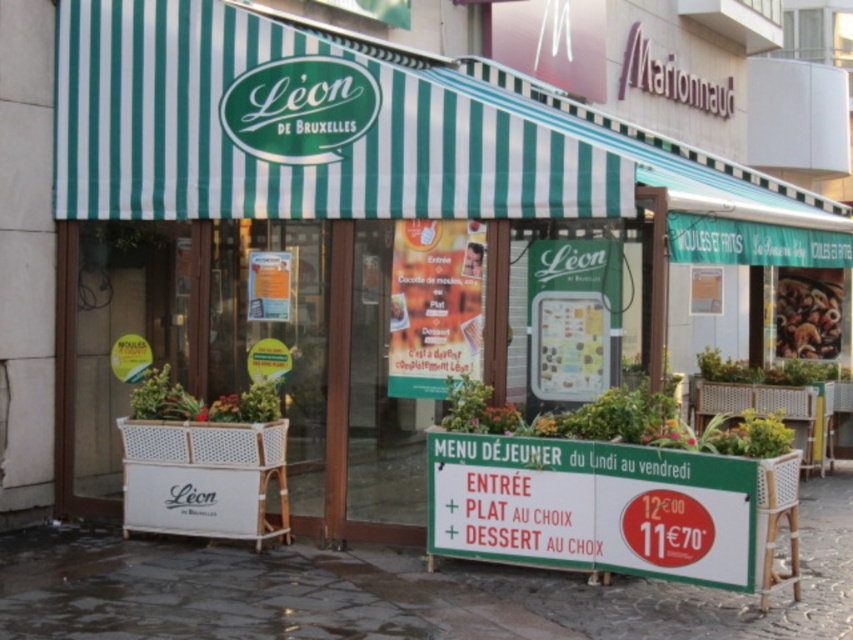
Question: Does green striped awning at upper center have a greater width compared to dark gray stone pavement at lower center?

Choices:
 (A) yes
 (B) no

Answer: (A)

Question: Is green striped awning at upper center smaller than dark gray stone pavement at lower center?

Choices:
 (A) no
 (B) yes

Answer: (A)

Question: Is dark gray stone pavement at lower center thinner than green plastic sign at center?

Choices:
 (A) no
 (B) yes

Answer: (A)

Question: Which of the following is the closest to the observer?

Choices:
 (A) dark gray stone pavement at lower center
 (B) green striped awning at upper center

Answer: (A)

Question: Which object is positioned farthest from the green plastic sign at center?

Choices:
 (A) green striped awning at upper center
 (B) dark gray stone pavement at lower center

Answer: (A)

Question: Which object is positioned closest to the dark gray stone pavement at lower center?

Choices:
 (A) green striped awning at upper center
 (B) green plastic sign at center

Answer: (B)